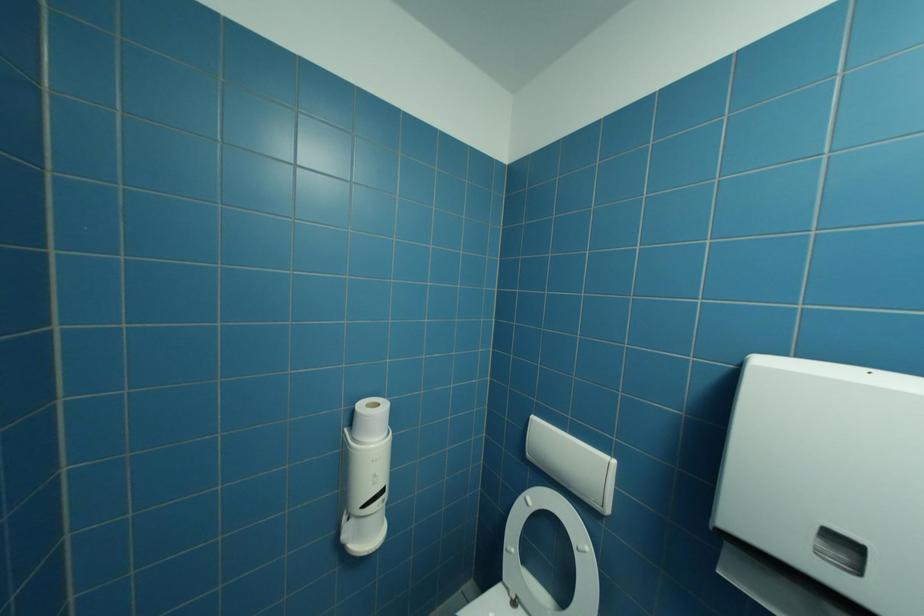
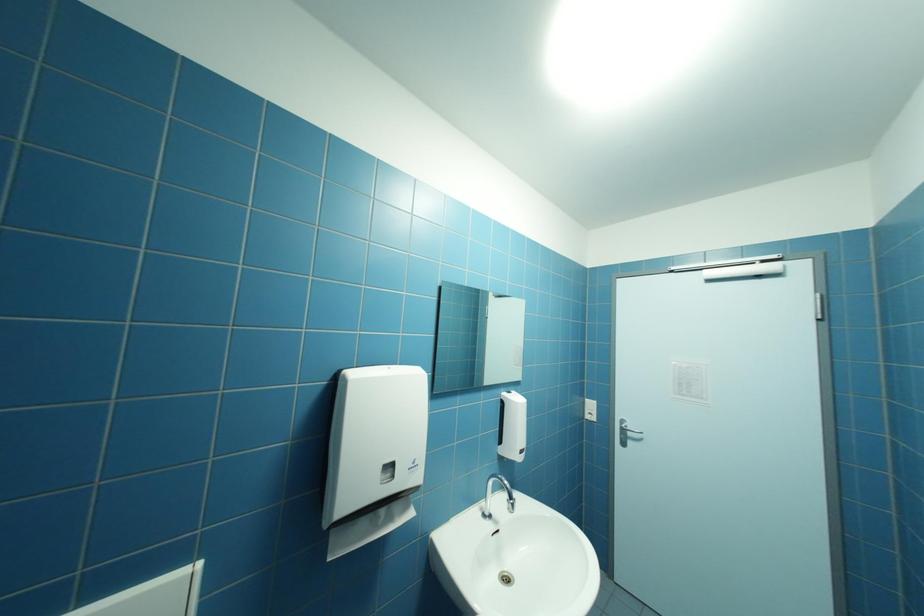
Question: The images are taken continuously from a first-person perspective. In which direction is your viewpoint rotating?

Choices:
 (A) Left
 (B) Right
 (C) Up
 (D) Down

Answer: (B)